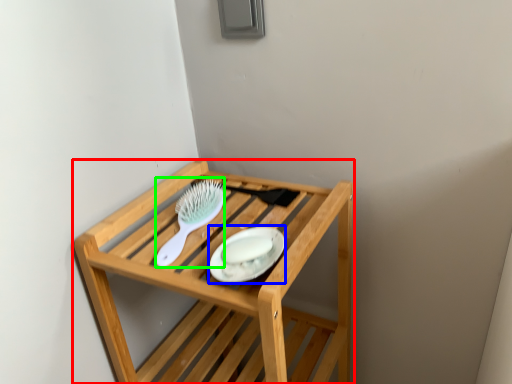
Question: Estimate the real-world distances between objects in this image. Which object is closer to furniture (highlighted by a red box), platter (highlighted by a blue box) or brush (highlighted by a green box)?

Choices:
 (A) platter
 (B) brush

Answer: (B)